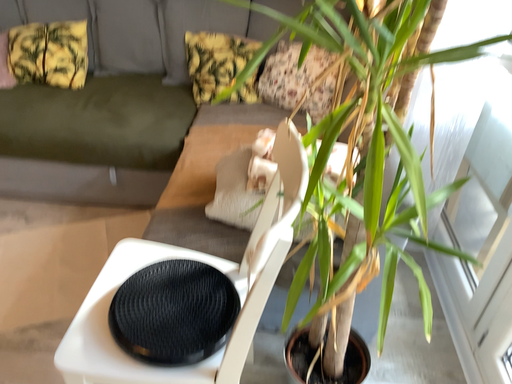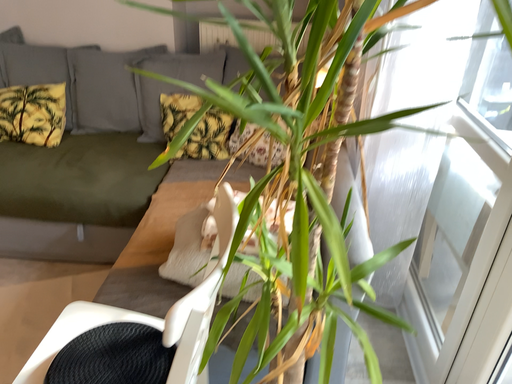
Question: Which way did the camera rotate in the video?

Choices:
 (A) rotated upward
 (B) rotated downward

Answer: (A)